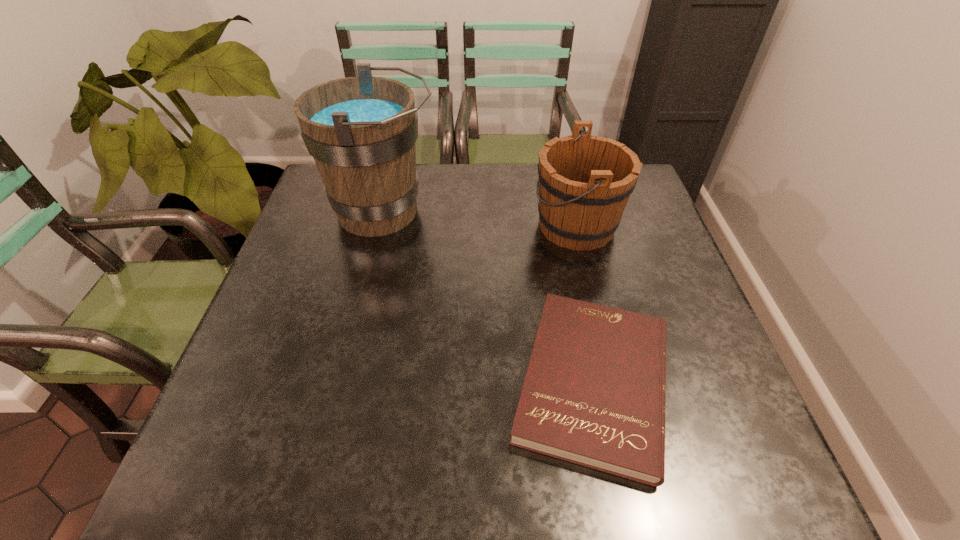
Identify which object is located as the nearest to the leftmost object. Please provide its 2D coordinates. Your answer should be formatted as a tuple, i.e. [(x, y)], where the tuple contains the x and y coordinates of a point satisfying the conditions above.

[(585, 181)]

Find the location of `free space that satisfies the following two spatial constraints: 1. with a handle on the side of the hardback book; 2. on the left side of the taller wine bucket`. free space that satisfies the following two spatial constraints: 1. with a handle on the side of the hardback book; 2. on the left side of the taller wine bucket is located at coordinates (343, 382).

Where is `vacant space that satisfies the following two spatial constraints: 1. on the back side of the shortest object; 2. with a handle on the side of the left wine bucket`? The image size is (960, 540). vacant space that satisfies the following two spatial constraints: 1. on the back side of the shortest object; 2. with a handle on the side of the left wine bucket is located at coordinates pyautogui.click(x=559, y=211).

Locate an element on the screen. This screenshot has height=540, width=960. vacant area in the image that satisfies the following two spatial constraints: 1. with a handle on the side of the hardback book; 2. on the right side of the left wine bucket is located at coordinates pos(343,382).

At what (x,y) coordinates should I click in order to perform the action: click on vacant point that satisfies the following two spatial constraints: 1. with a handle on the side of the left wine bucket; 2. on the right side of the shortest object. Please return your answer as a coordinate pair (x, y). Looking at the image, I should click on (343, 382).

At what (x,y) coordinates should I click in order to perform the action: click on vacant space that satisfies the following two spatial constraints: 1. with a handle on the side of the nearest object; 2. on the right side of the taller wine bucket. Please return your answer as a coordinate pair (x, y). Image resolution: width=960 pixels, height=540 pixels. Looking at the image, I should click on (343, 382).

Where is `vacant area in the image that satisfies the following two spatial constraints: 1. on the back side of the nearest object; 2. with a handle on the side of the tallest object`? vacant area in the image that satisfies the following two spatial constraints: 1. on the back side of the nearest object; 2. with a handle on the side of the tallest object is located at coordinates (559, 211).

You are a GUI agent. You are given a task and a screenshot of the screen. Output one action in this format:
    pyautogui.click(x=<x>, y=<y>)
    Task: Click on the vacant region that satisfies the following two spatial constraints: 1. on the side of the shorter wine bucket with the handle for carrying; 2. on the front side of the hardback book
    
    Given the screenshot: What is the action you would take?
    pyautogui.click(x=613, y=382)

You are a GUI agent. You are given a task and a screenshot of the screen. Output one action in this format:
    pyautogui.click(x=<x>, y=<y>)
    Task: Click on the vacant space that satisfies the following two spatial constraints: 1. with a handle on the side of the taller wine bucket; 2. on the left side of the shortest object
    This screenshot has width=960, height=540.
    Given the screenshot: What is the action you would take?
    pyautogui.click(x=343, y=382)